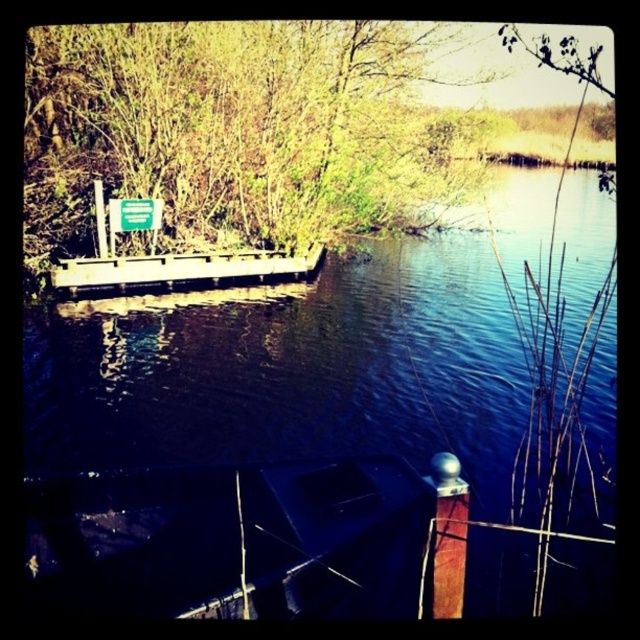
You are standing on the dock and want to place a floating sensor at the exact center of the blue water at center. According to the coordinates provided, where should you aim to place the sensor?

The exact center of the blue water at center is located at the coordinates point (x=336, y=433), so you should aim to place the floating sensor there.

You are standing on the wooden dock at center and want to see the blue water at center. In which direction should you look relative to the dock?

The blue water at center is in front of the wooden dock at center, so you should look forward from the dock to see it.